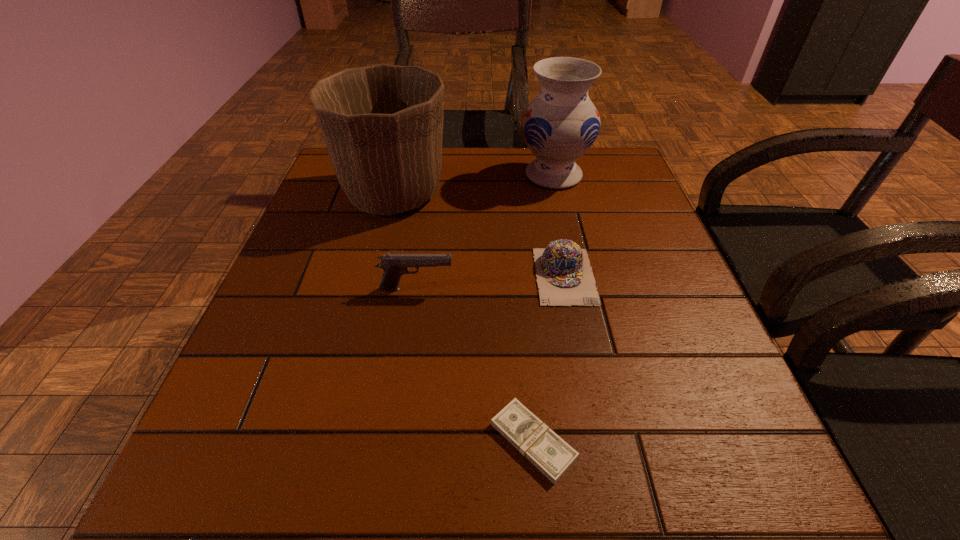
Find the location of a particular element. vase is located at coordinates (560, 124).

Where is `flowerpot`? flowerpot is located at coordinates 383,124.

The width and height of the screenshot is (960, 540). I want to click on the third tallest object, so click(x=394, y=265).

Locate an element on the screen. This screenshot has height=540, width=960. cap is located at coordinates (564, 276).

The width and height of the screenshot is (960, 540). In order to click on the nearest object in this screenshot , I will do `click(549, 453)`.

At what (x,y) coordinates should I click in order to perform the action: click on money. Please return your answer as a coordinate pair (x, y). Looking at the image, I should click on (549, 453).

Locate an element on the screen. vacant space located 0.050m on the left of the vase is located at coordinates (498, 176).

I want to click on blank space located on the right of the flowerpot, so click(x=535, y=194).

What are the coordinates of `vacant point located 0.380m at the barrel of the third tallest object` in the screenshot? It's located at (650, 289).

Locate an element on the screen. The height and width of the screenshot is (540, 960). vacant area situated 0.190m on the front, side, and top of the fourth tallest object is located at coordinates (589, 399).